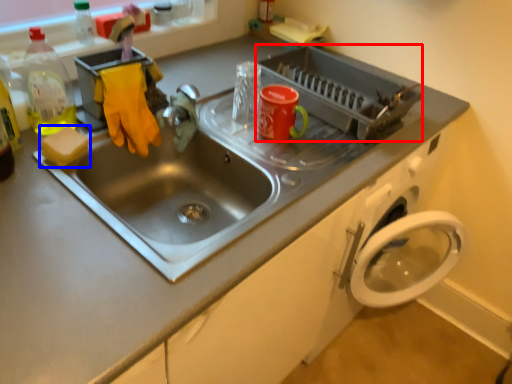
Question: Which point is further to the camera, appliance (highlighted by a red box) or soap (highlighted by a blue box)?

Choices:
 (A) appliance
 (B) soap

Answer: (A)